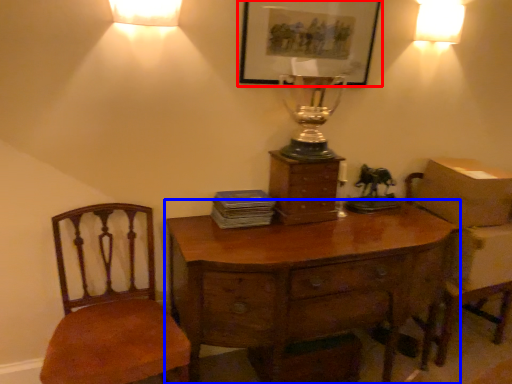
Question: Which of the following is the farthest to the observer, picture frame (highlighted by a red box) or desk (highlighted by a blue box)?

Choices:
 (A) picture frame
 (B) desk

Answer: (A)